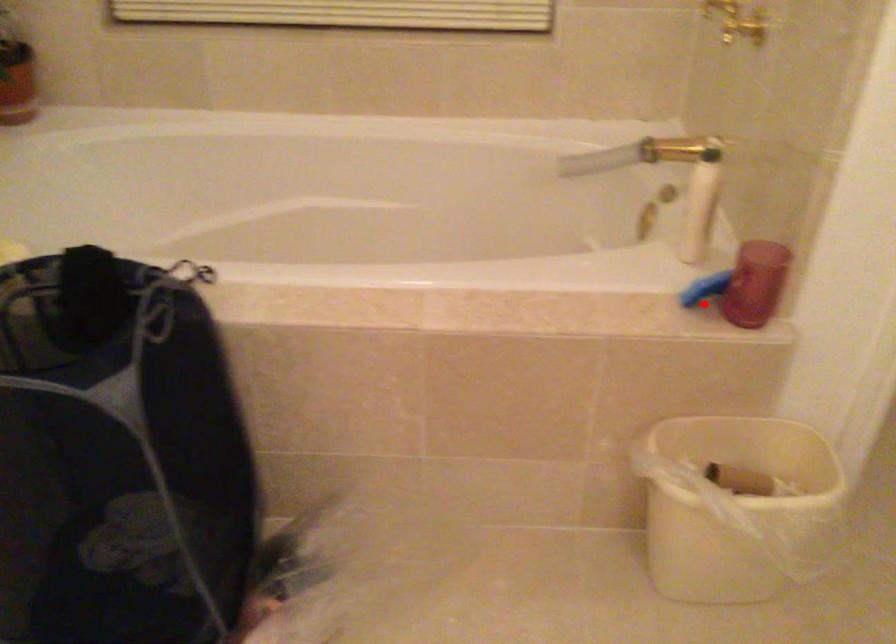
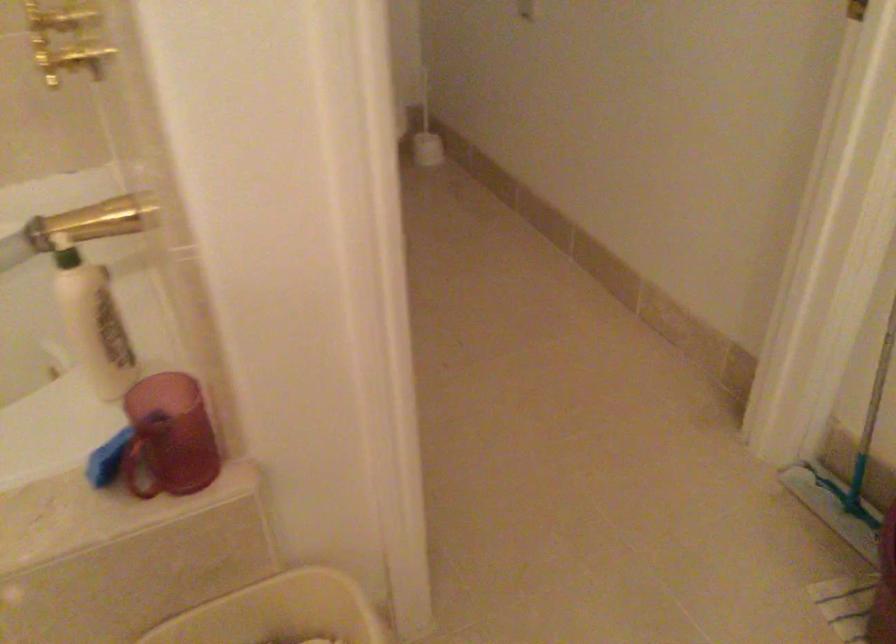
The point at the highlighted location is marked in the first image. Where is the corresponding point in the second image?

(140, 462)